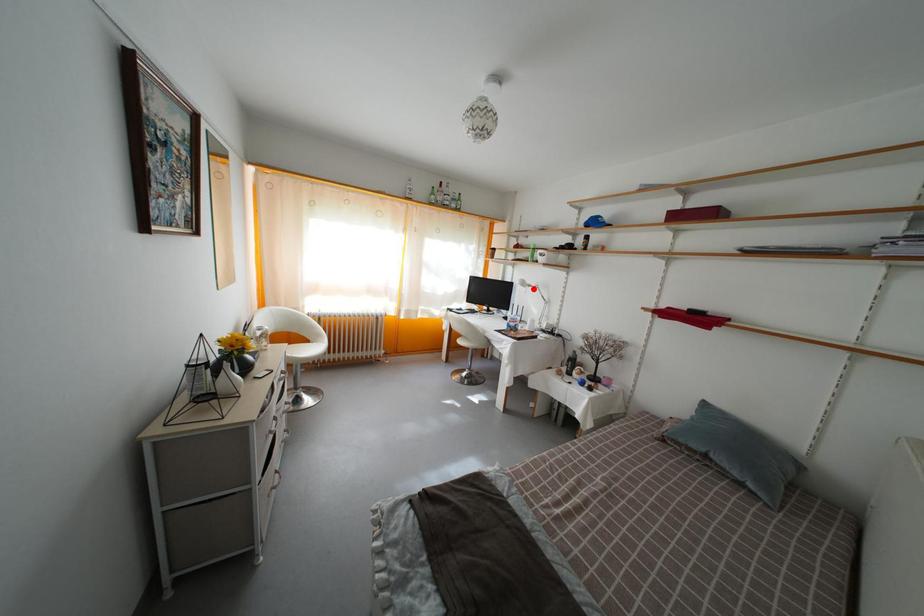
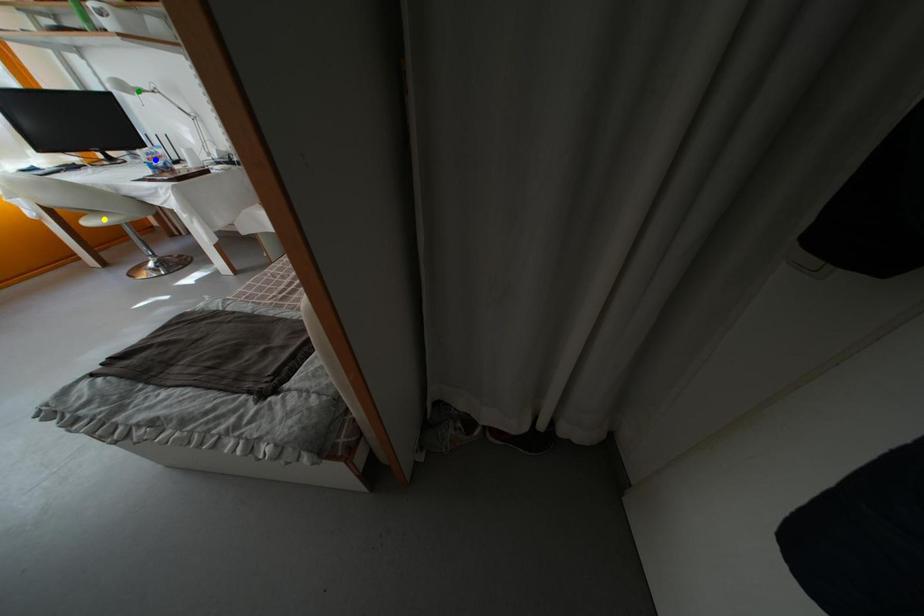
Question: I am providing you with two images of the same scene from different viewpoints. A red point is marked on the first image. You are given multiple points on the second image. Which point in image 2 is actually the same real-world point as the red point in image 1?

Choices:
 (A) blue point
 (B) green point
 (C) yellow point

Answer: (B)